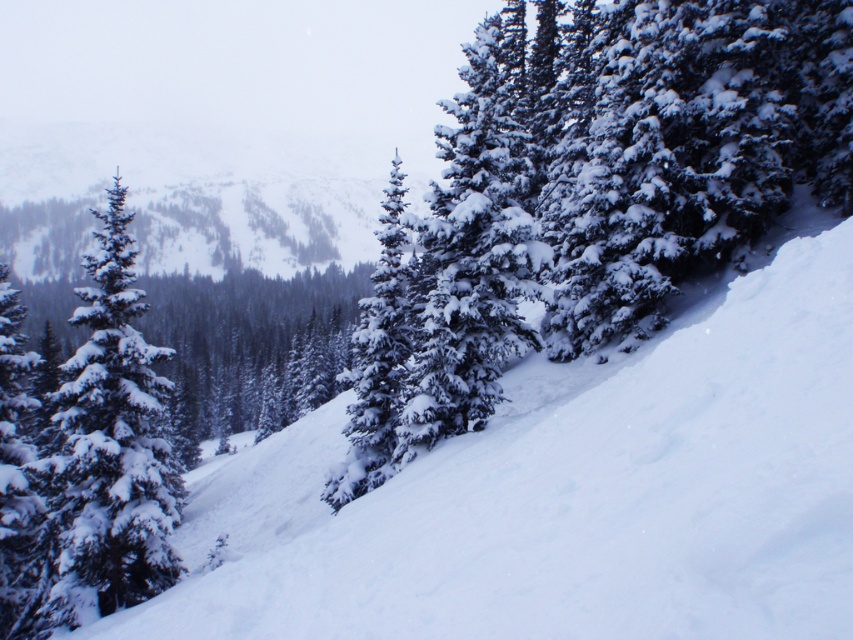
Question: Which point is farther to the camera?

Choices:
 (A) snow-covered evergreen at left
 (B) snow-covered evergreen tree at center

Answer: (A)

Question: Which of these objects is positioned farthest from the snow-covered evergreen tree at center?

Choices:
 (A) white snow at center
 (B) snow-covered evergreen at left

Answer: (B)

Question: Considering the relative positions of white snow at center and snow-covered evergreen at left in the image provided, where is white snow at center located with respect to snow-covered evergreen at left?

Choices:
 (A) right
 (B) left

Answer: (A)

Question: Is white snow at center below snow-covered evergreen at left?

Choices:
 (A) no
 (B) yes

Answer: (A)

Question: Which point is closer to the camera?

Choices:
 (A) snow-covered evergreen tree at center
 (B) white snow at center

Answer: (B)

Question: Does white snow at center have a smaller size compared to snow-covered evergreen at left?

Choices:
 (A) no
 (B) yes

Answer: (B)